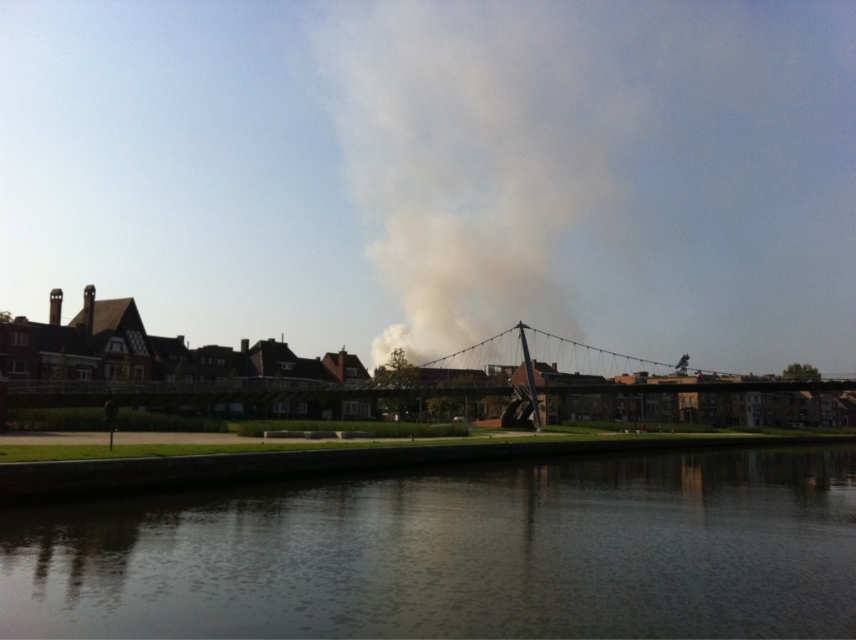
Which is in front, point (155, 541) or point (459, 387)?

Positioned in front is point (155, 541).

Does dark reflective water at lower center appear on the left side of metallic gray suspension bridge at center?

Indeed, dark reflective water at lower center is positioned on the left side of metallic gray suspension bridge at center.

Who is more distant from viewer, (586, 609) or (217, 392)?

Point (217, 392)

Locate an element on the screen. dark reflective water at lower center is located at coordinates (456, 554).

Is gray smoke at center wider than metallic gray suspension bridge at center?

Yes.

Does gray smoke at center appear on the right side of metallic gray suspension bridge at center?

No, gray smoke at center is not to the right of metallic gray suspension bridge at center.

The width and height of the screenshot is (856, 640). What do you see at coordinates (473, 157) in the screenshot? I see `gray smoke at center` at bounding box center [473, 157].

Identify the location of gray smoke at center. Image resolution: width=856 pixels, height=640 pixels. (473, 157).

Is dark reflective water at lower center to the left of gray smoke at center from the viewer's perspective?

Yes, dark reflective water at lower center is to the left of gray smoke at center.

Can you confirm if dark reflective water at lower center is positioned below gray smoke at center?

Yes.

Is point (568, 604) positioned after point (580, 228)?

No, (568, 604) is closer to viewer.

The width and height of the screenshot is (856, 640). In order to click on dark reflective water at lower center in this screenshot , I will do `click(456, 554)`.